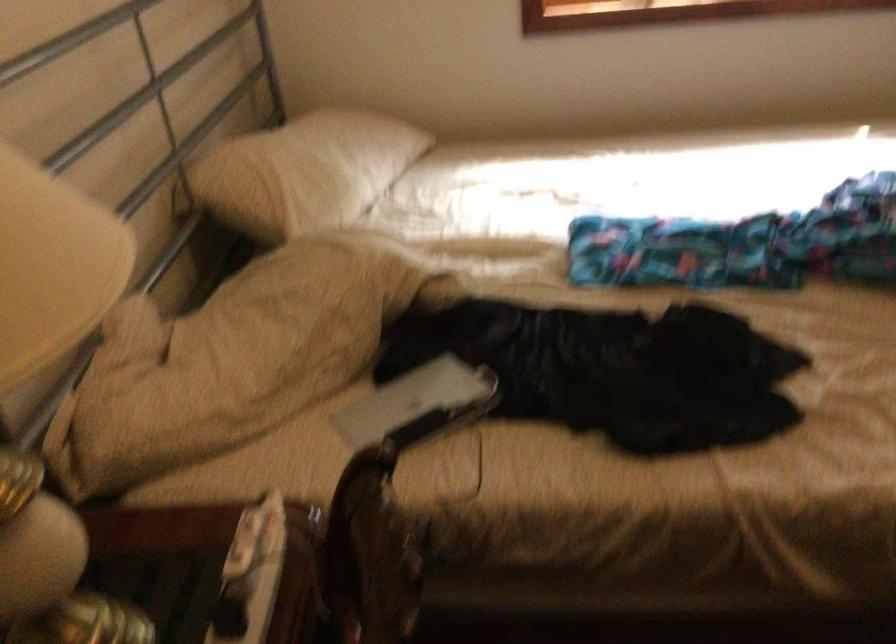
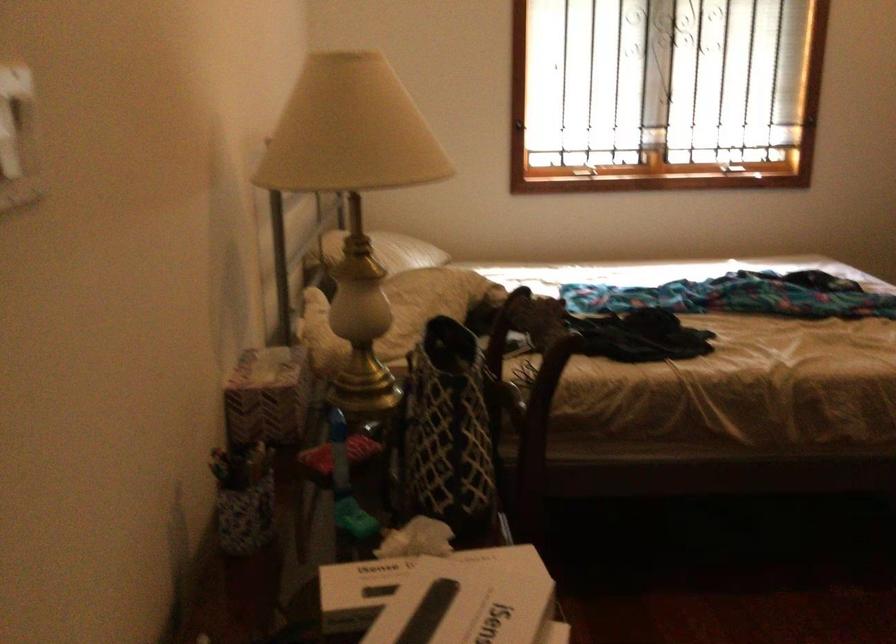
In the second image, find the point that corresponds to point 297,171 in the first image.

(388, 251)